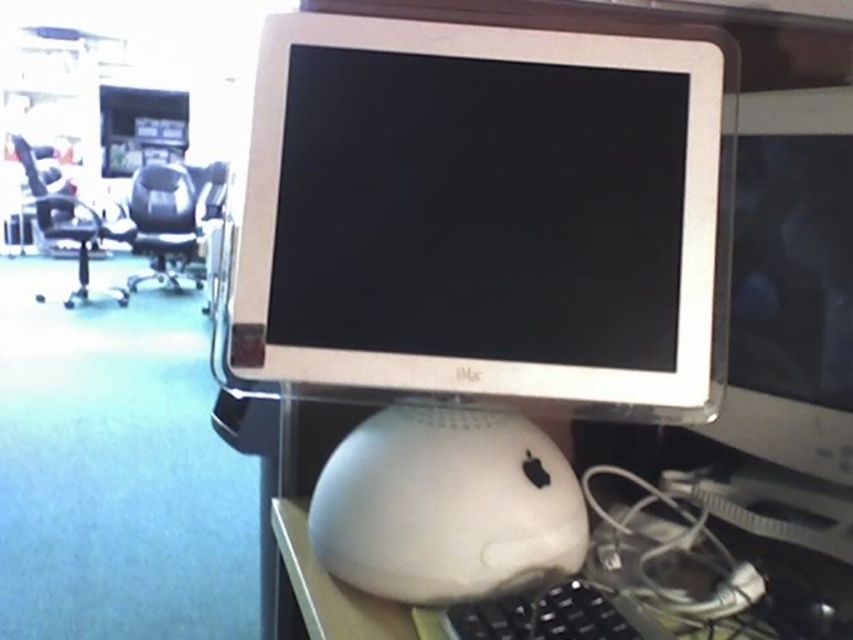
You are standing in front of the workspace and want to place a small plant between the two points, point 1 at (316, 512) and point 2 at (566, 625). Which point should the plant be closer to in order to be closer to the viewer?

The plant should be closer to point 1 at (316, 512) because it is closer to the viewer than point 2 at (566, 625).

You are organizing the desk and need to place a new item. Where is the white matte mouse at center currently positioned on the desk?

The white matte mouse at center is located at point [445,506].

You are a person with a height of 6 feet. You are standing in front of the workspace and want to place a 12 inch tall object on the white plastic table at lower center. Can you reach the table to place the object without moving your feet?

The white plastic table at lower center is 26.28 inches away from the viewer. Since the average arm length for a 6 foot tall person is about 26 inches, you might just barely reach the table to place the object, but it could be a bit challenging.